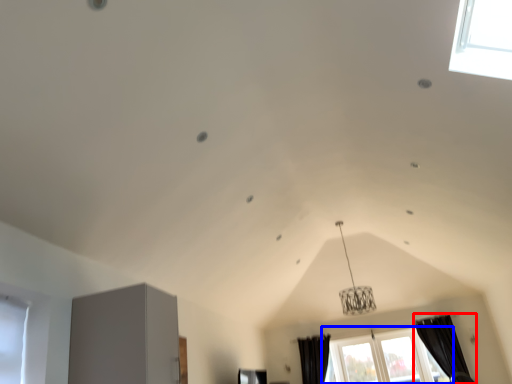
Question: Which object appears closest to the camera in this image, curtain (highlighted by a red box) or window (highlighted by a blue box)?

Choices:
 (A) curtain
 (B) window

Answer: (A)